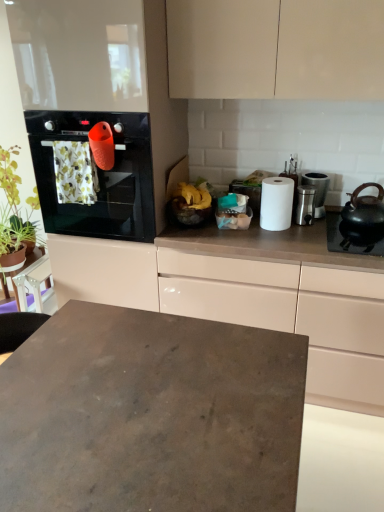
Find the location of a particular element. Image resolution: width=384 pixels, height=512 pixels. free space in front of satin silver canister at center right, marked as the first appliance in a left-to-right arrangement is located at coordinates (322, 232).